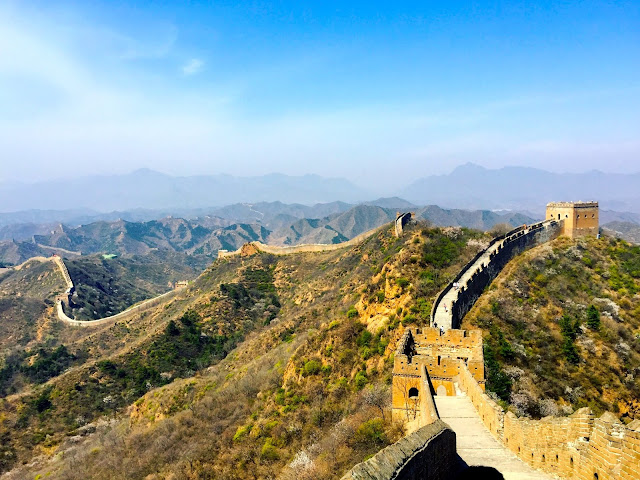
Image resolution: width=640 pixels, height=480 pixels. What are the coordinates of `top of wall` in the screenshot? It's located at (463, 429), (438, 305).